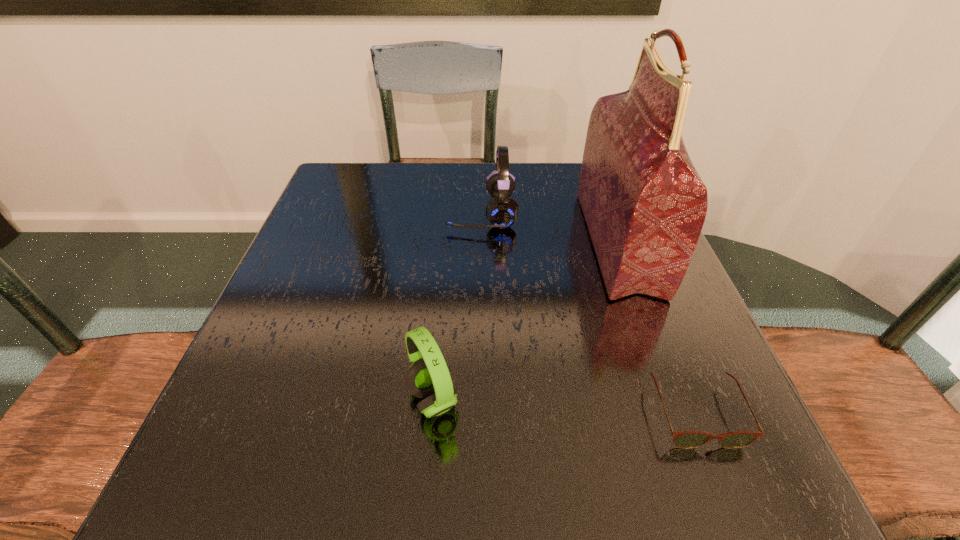
This screenshot has width=960, height=540. I want to click on empty space that is in between the nearer headset and the spectacles, so click(x=564, y=407).

Where is `vacant space that's between the nearer headset and the handbag`? This screenshot has width=960, height=540. vacant space that's between the nearer headset and the handbag is located at coordinates (525, 320).

Find the location of a particular element. This screenshot has height=540, width=960. free point between the tallest object and the nearer headset is located at coordinates (525, 320).

I want to click on free spot between the shortest object and the farther headset, so click(588, 313).

Identify which object is the second nearest to the handbag. Please provide its 2D coordinates. Your answer should be formatted as a tuple, i.e. [(x, y)], where the tuple contains the x and y coordinates of a point satisfying the conditions above.

[(684, 439)]

Image resolution: width=960 pixels, height=540 pixels. I want to click on object that stands as the second closest to the nearer headset, so click(644, 203).